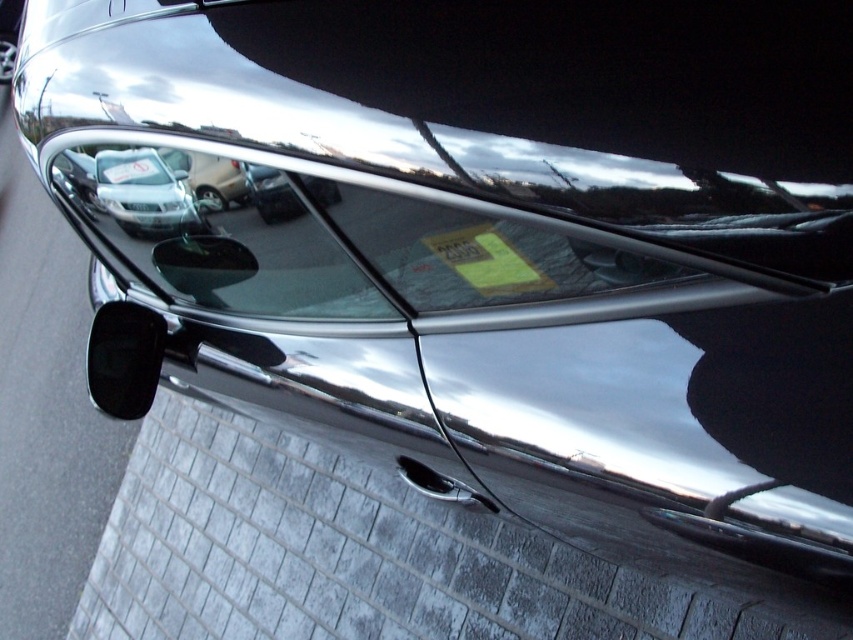
Question: Is the position of clear glass window at center more distant than that of white plastic license plate at center?

Choices:
 (A) no
 (B) yes

Answer: (A)

Question: Among these objects, which one is farthest from the camera?

Choices:
 (A) clear glass window at center
 (B) white plastic license plate at center

Answer: (B)

Question: Which of the following is the farthest from the observer?

Choices:
 (A) (144, 205)
 (B) (192, 264)

Answer: (B)

Question: Observing the image, what is the correct spatial positioning of clear glass window at center in reference to white plastic license plate at center?

Choices:
 (A) above
 (B) below

Answer: (B)

Question: Can you confirm if clear glass window at center is smaller than white plastic license plate at center?

Choices:
 (A) no
 (B) yes

Answer: (A)